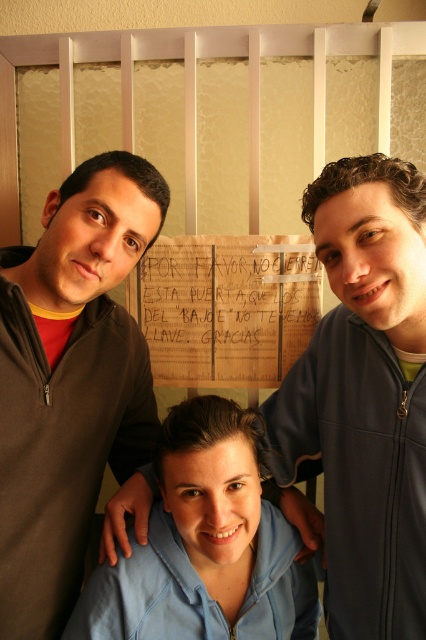
Question: Does blue fleece jacket at center have a smaller size compared to dark brown zip-up sweater at left?

Choices:
 (A) yes
 (B) no

Answer: (A)

Question: Which point is closer to the camera taking this photo?

Choices:
 (A) (247, 316)
 (B) (405, 598)

Answer: (B)

Question: Can you confirm if light blue zip-up hoodie at center is smaller than wooden sign at center?

Choices:
 (A) yes
 (B) no

Answer: (B)

Question: Is blue fleece jacket at center further to the viewer compared to light blue zip-up hoodie at center?

Choices:
 (A) no
 (B) yes

Answer: (A)

Question: Which object is positioned closest to the blue fleece jacket at center?

Choices:
 (A) light blue zip-up hoodie at center
 (B) wooden sign at center
 (C) dark brown zip-up sweater at left

Answer: (A)

Question: Considering the real-world distances, which object is farthest from the wooden sign at center?

Choices:
 (A) blue fleece jacket at center
 (B) light blue zip-up hoodie at center
 (C) dark brown zip-up sweater at left

Answer: (B)